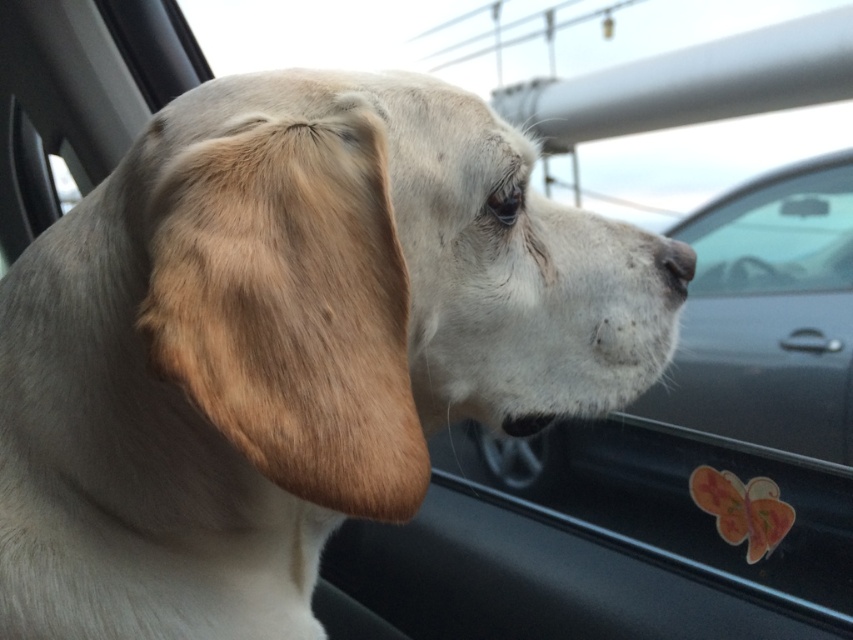
Can you confirm if light beige fur at center is shorter than white matte nose at center?

No, light beige fur at center is not shorter than white matte nose at center.

Between light beige fur at center and white matte nose at center, which one is positioned higher?

Positioned higher is white matte nose at center.

What are the coordinates of `light beige fur at center` in the screenshot? It's located at (287, 346).

Where is `light beige fur at center`? This screenshot has height=640, width=853. light beige fur at center is located at coordinates (287, 346).